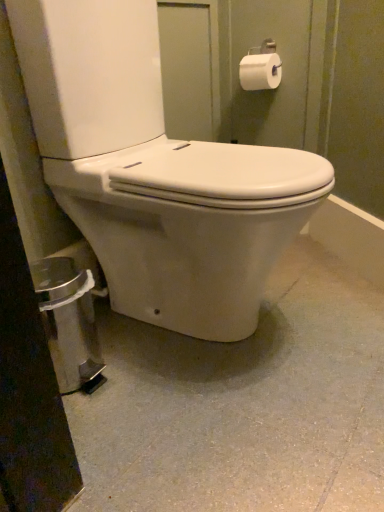
This screenshot has width=384, height=512. Identify the location of white smooth concrete at center. (243, 404).

What are the coordinates of `white glossy toilet at center` in the screenshot? It's located at (155, 172).

Is white matte toilet paper at upper right oriented away from white smooth concrete at center?

That's not correct — white matte toilet paper at upper right is not looking away from white smooth concrete at center.

Is white matte toilet paper at upper right thinner than white smooth concrete at center?

Yes.

Between white matte toilet paper at upper right and white smooth concrete at center, which one has larger size?

white smooth concrete at center is bigger.

Considering the relative sizes of white matte toilet paper at upper right and white smooth concrete at center in the image provided, is white matte toilet paper at upper right shorter than white smooth concrete at center?

In fact, white matte toilet paper at upper right may be taller than white smooth concrete at center.

Is white smooth concrete at center completely or partially outside of white matte toilet paper at upper right?

Yes, white smooth concrete at center is not within white matte toilet paper at upper right.

Would you consider white smooth concrete at center to be distant from white matte toilet paper at upper right?

Absolutely, white smooth concrete at center is distant from white matte toilet paper at upper right.

The height and width of the screenshot is (512, 384). What are the coordinates of `toilet paper behind the white smooth concrete at center` in the screenshot? It's located at (260, 71).

Is white matte toilet paper at upper right at the left side of white glossy toilet at center?

In fact, white matte toilet paper at upper right is to the right of white glossy toilet at center.

How different are the orientations of white matte toilet paper at upper right and white glossy toilet at center in degrees?

white matte toilet paper at upper right and white glossy toilet at center are facing 89.5 degrees away from each other.

Can you confirm if white matte toilet paper at upper right is thinner than white glossy toilet at center?

Correct, the width of white matte toilet paper at upper right is less than that of white glossy toilet at center.

Considering the positions of objects white glossy toilet at center and white matte toilet paper at upper right in the image provided, who is more to the left, white glossy toilet at center or white matte toilet paper at upper right?

white glossy toilet at center is more to the left.

Is white glossy toilet at center taller or shorter than white matte toilet paper at upper right?

Considering their sizes, white glossy toilet at center has more height than white matte toilet paper at upper right.

Consider the image. From the image's perspective, is white glossy toilet at center under white matte toilet paper at upper right?

Yes, from the image's perspective, white glossy toilet at center is below white matte toilet paper at upper right.

Would you say white glossy toilet at center contains white matte toilet paper at upper right?

No.

Is white smooth concrete at center bigger than white glossy toilet at center?

Actually, white smooth concrete at center might be smaller than white glossy toilet at center.

From the picture: Does white smooth concrete at center have a greater height compared to white glossy toilet at center?

No.

At what (x,y) coordinates should I click in order to perform the action: click on toilet on the left of white smooth concrete at center. Please return your answer as a coordinate pair (x, y). The width and height of the screenshot is (384, 512). Looking at the image, I should click on (155, 172).

Consider the image. Is white smooth concrete at center far from white glossy toilet at center?

white smooth concrete at center is near white glossy toilet at center, not far away.

Is white glossy toilet at center in contact with white smooth concrete at center?

white glossy toilet at center is not next to white smooth concrete at center, and they're not touching.

Do you think white glossy toilet at center is within white smooth concrete at center, or outside of it?

white glossy toilet at center is spatially situated outside white smooth concrete at center.

From the image's perspective, is white glossy toilet at center on white smooth concrete at center?

Correct, white glossy toilet at center appears higher than white smooth concrete at center in the image.

Looking at this image, who is shorter, white glossy toilet at center or white smooth concrete at center?

With less height is white smooth concrete at center.

Find the location of a particular element. This screenshot has height=512, width=384. concrete directly beneath the white matte toilet paper at upper right (from a real-world perspective) is located at coordinates (243, 404).

Image resolution: width=384 pixels, height=512 pixels. Identify the location of toilet paper that is above the white smooth concrete at center (from the image's perspective). (260, 71).

Which object lies further to the anchor point white matte toilet paper at upper right, white smooth concrete at center or white glossy toilet at center?

Among the two, white smooth concrete at center is located further to white matte toilet paper at upper right.

Based on their spatial positions, is white matte toilet paper at upper right or white smooth concrete at center closer to white glossy toilet at center?

white smooth concrete at center is closer to white glossy toilet at center.

When comparing their distances from white matte toilet paper at upper right, does white glossy toilet at center or white smooth concrete at center seem closer?

Among the two, white glossy toilet at center is located nearer to white matte toilet paper at upper right.

Considering their positions, is white smooth concrete at center positioned further to white glossy toilet at center than white matte toilet paper at upper right?

white matte toilet paper at upper right is further to white glossy toilet at center.

Which object lies further to the anchor point white smooth concrete at center, white matte toilet paper at upper right or white glossy toilet at center?

Among the two, white matte toilet paper at upper right is located further to white smooth concrete at center.

Which object lies further to the anchor point white smooth concrete at center, white glossy toilet at center or white matte toilet paper at upper right?

white matte toilet paper at upper right is further to white smooth concrete at center.

Locate an element on the screen. The height and width of the screenshot is (512, 384). toilet between white smooth concrete at center and white matte toilet paper at upper right along the z-axis is located at coordinates 155,172.